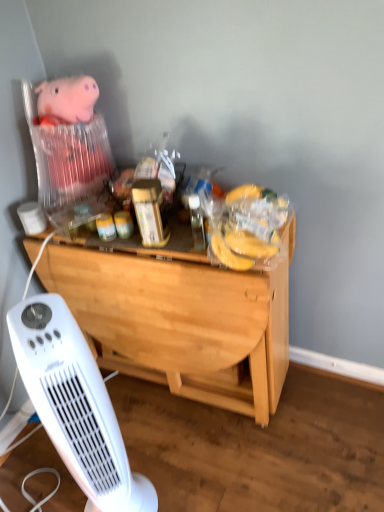
Question: From a real-world perspective, relative to white plastic heater at lower left, is plush pink pig at upper left vertically above or below?

Choices:
 (A) below
 (B) above

Answer: (B)

Question: Is plush pink pig at upper left bigger or smaller than white plastic heater at lower left?

Choices:
 (A) small
 (B) big

Answer: (A)

Question: Which object is positioned farthest from the plush pink pig at upper left?

Choices:
 (A) light wood desk at center
 (B) white plastic heater at lower left

Answer: (B)

Question: Which is farther from the light wood desk at center?

Choices:
 (A) plush pink pig at upper left
 (B) white plastic heater at lower left

Answer: (A)